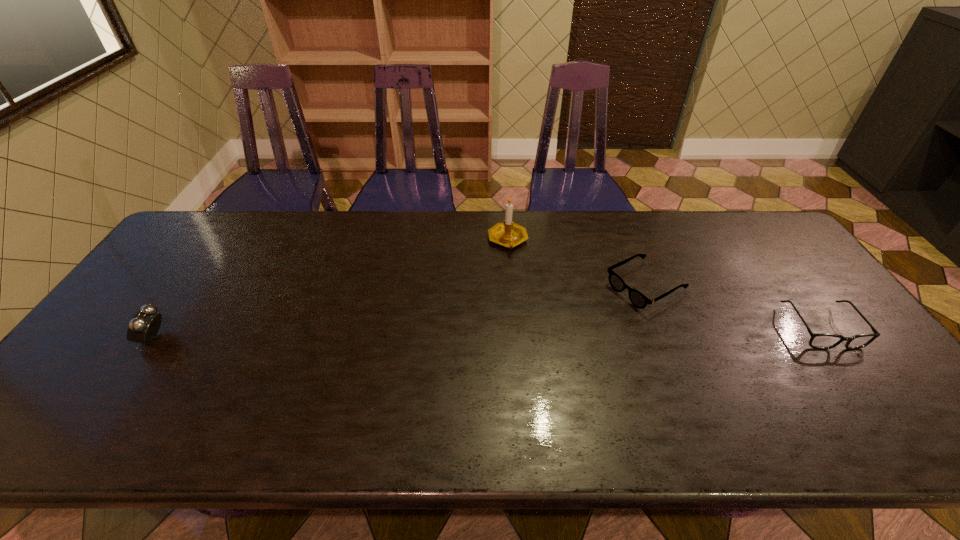
I want to click on vacant spot on the desktop that is between the leftmost object and the rightmost object and is positioned on the arms of the left spectacles, so pos(564,332).

At what (x,y) coordinates should I click in order to perform the action: click on vacant spot on the desktop that is between the third shortest object and the rightmost object and is positioned with a handle on the candle holder. Please return your answer as a coordinate pair (x, y). The height and width of the screenshot is (540, 960). Looking at the image, I should click on (589, 331).